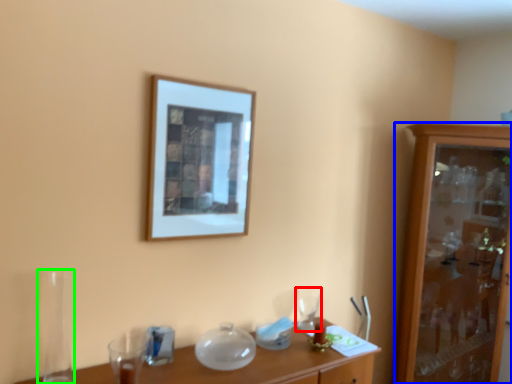
Question: Which is farther away from tableware (highlighted by a red box)? cabinetry (highlighted by a blue box) or glass vase (highlighted by a green box)?

Choices:
 (A) cabinetry
 (B) glass vase

Answer: (B)